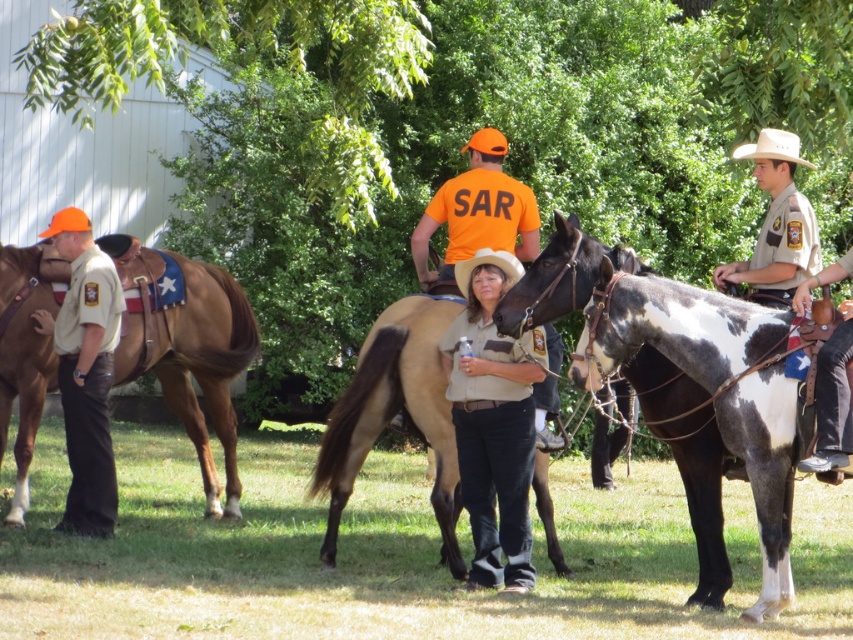
Is brown leather saddle at left positioned at the back of brown uniform at center?

Yes.

Is brown leather saddle at left taller than brown uniform at center?

No.

Between point (180, 376) and point (531, 422), which one is positioned behind?

Point (180, 376)

Where is `brown leather saddle at left`? The image size is (853, 640). brown leather saddle at left is located at coordinates (190, 355).

Can you confirm if black-and-white speckled horse at center-right is smaller than tan uniform at left?

No, black-and-white speckled horse at center-right is not smaller than tan uniform at left.

Who is more distant from viewer, (675,401) or (65,438)?

Point (65,438)

Is point (753, 476) positioned in front of point (112, 288)?

Yes, it is.

The width and height of the screenshot is (853, 640). Find the location of `black-and-white speckled horse at center-right`. black-and-white speckled horse at center-right is located at coordinates (683, 387).

Is green grass at lower center to the left of black-and-white speckled horse at center-right from the viewer's perspective?

Yes, green grass at lower center is to the left of black-and-white speckled horse at center-right.

Is green grass at lower center positioned before black-and-white speckled horse at center-right?

Yes.

Does point (83, 577) come behind point (608, 330)?

Yes, it is behind point (608, 330).

Where is `green grass at lower center`? The width and height of the screenshot is (853, 640). green grass at lower center is located at coordinates (389, 556).